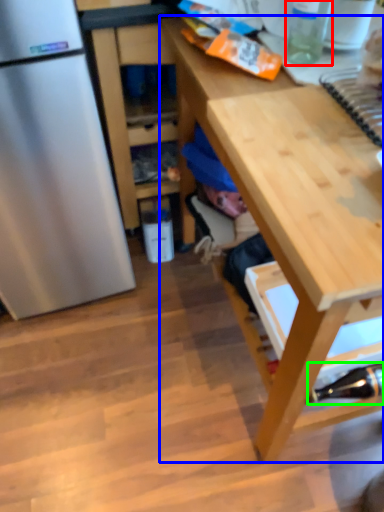
Question: Considering the real-world distances, which object is farthest from bottle (highlighted by a red box)? desk (highlighted by a blue box) or bottle (highlighted by a green box)?

Choices:
 (A) desk
 (B) bottle

Answer: (B)